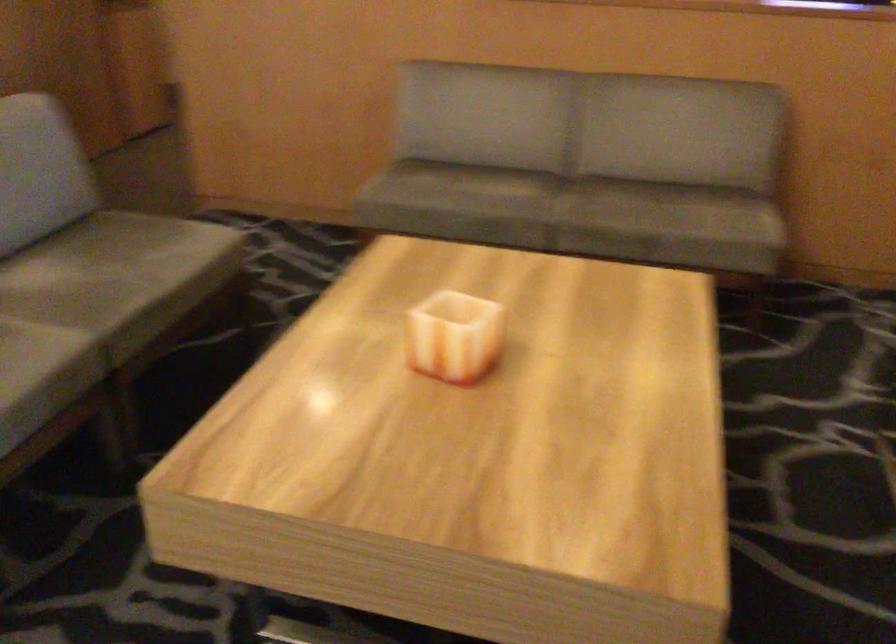
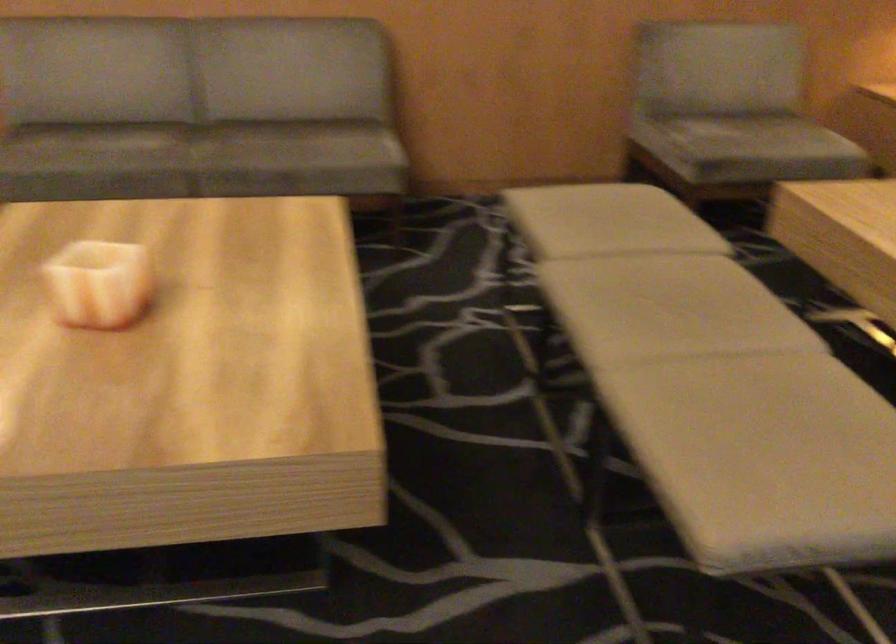
In the second image, find the point that corresponds to pixel 579 200 in the first image.

(209, 144)